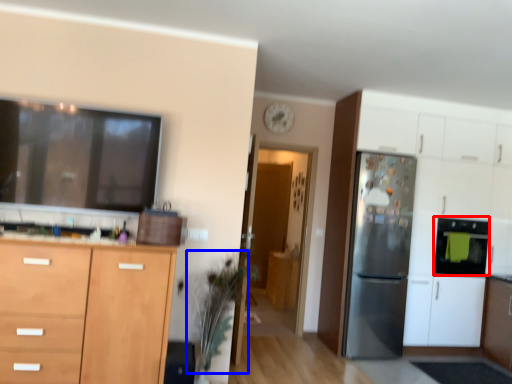
Question: Among these objects, which one is farthest to the camera, appliance (highlighted by a red box) or plant (highlighted by a blue box)?

Choices:
 (A) appliance
 (B) plant

Answer: (A)